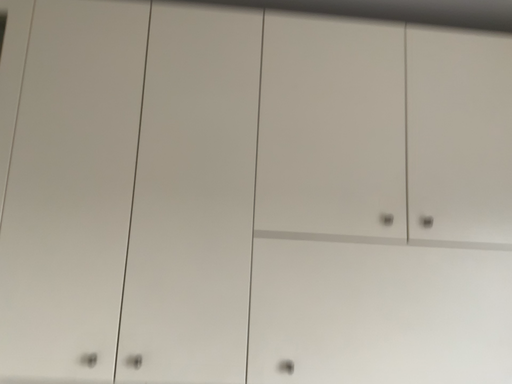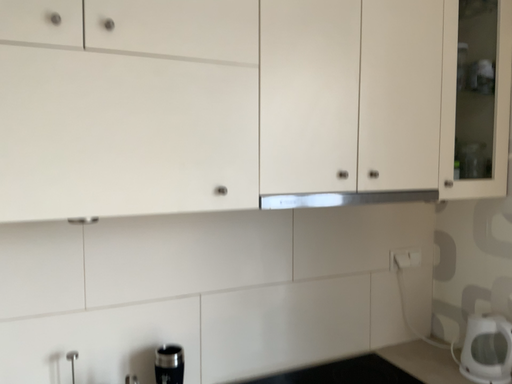
Question: Which way did the camera rotate in the video?

Choices:
 (A) rotated upward
 (B) rotated downward

Answer: (B)